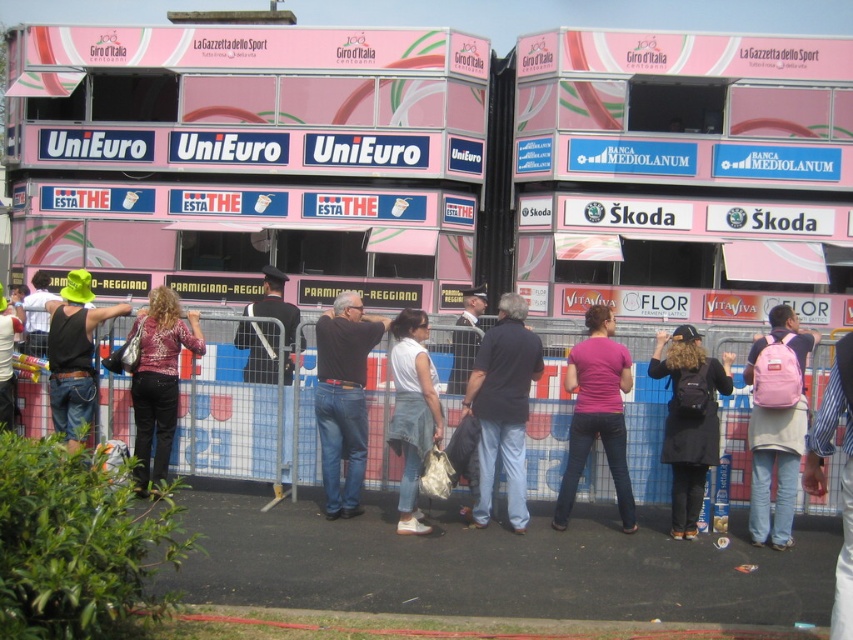
Is pink matte shirt at center shorter than matte black jacket at center?

No, pink matte shirt at center is not shorter than matte black jacket at center.

The width and height of the screenshot is (853, 640). What are the coordinates of `pink matte shirt at center` in the screenshot? It's located at (596, 413).

Is point (575, 472) positioned in front of point (16, 323)?

Yes, point (575, 472) is closer to viewer.

This screenshot has width=853, height=640. I want to click on pink matte shirt at center, so pos(596,413).

Can you confirm if dark blue jeans at center is positioned below dark pink shirt at center?

Yes.

Who is more distant from viewer, (515, 419) or (164, 477)?

Positioned behind is point (164, 477).

Identify the location of dark blue jeans at center. (503, 406).

The image size is (853, 640). Find the location of `pink fabric backpack at center right`. pink fabric backpack at center right is located at coordinates (776, 428).

Is point (782, 452) behind point (171, 298)?

No, it is not.

I want to click on pink fabric backpack at center right, so click(x=776, y=428).